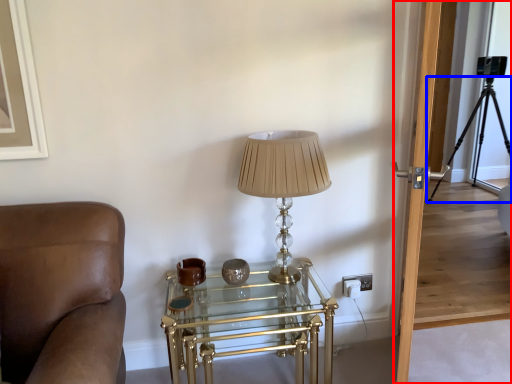
Question: Which object is closer to the camera taking this photo, glass door (highlighted by a red box) or tripod (highlighted by a blue box)?

Choices:
 (A) glass door
 (B) tripod

Answer: (A)